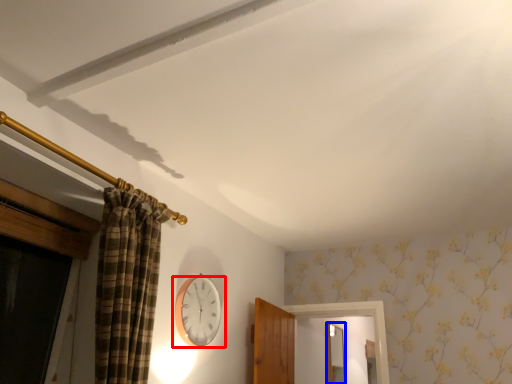
Question: Which object is further to the camera taking this photo, wall clock (highlighted by a red box) or mirror (highlighted by a blue box)?

Choices:
 (A) wall clock
 (B) mirror

Answer: (B)